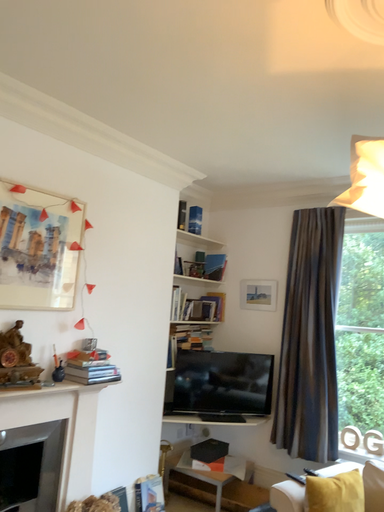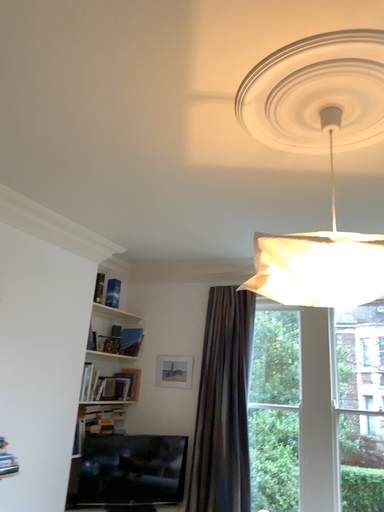
Question: How did the camera likely rotate when shooting the video?

Choices:
 (A) rotated downward
 (B) rotated upward

Answer: (B)